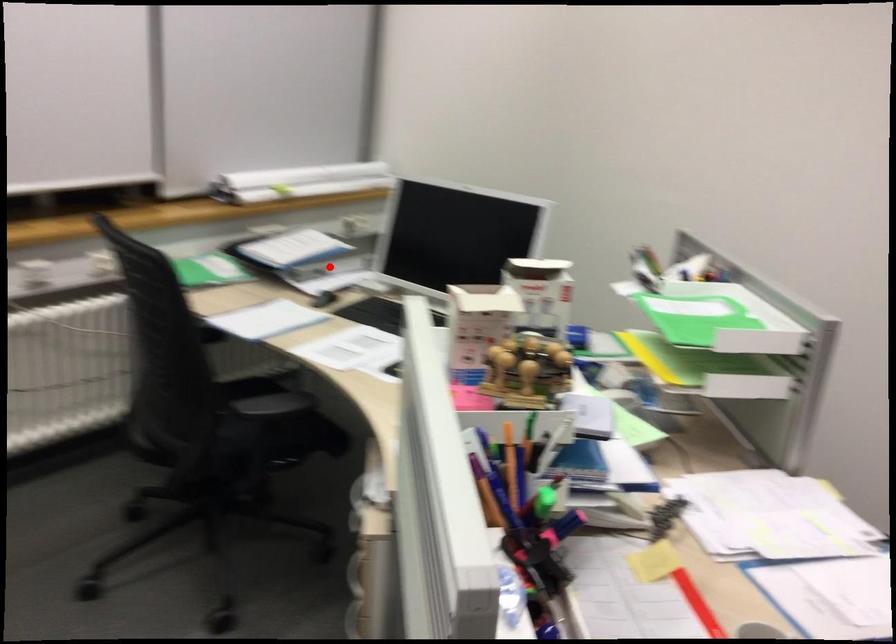
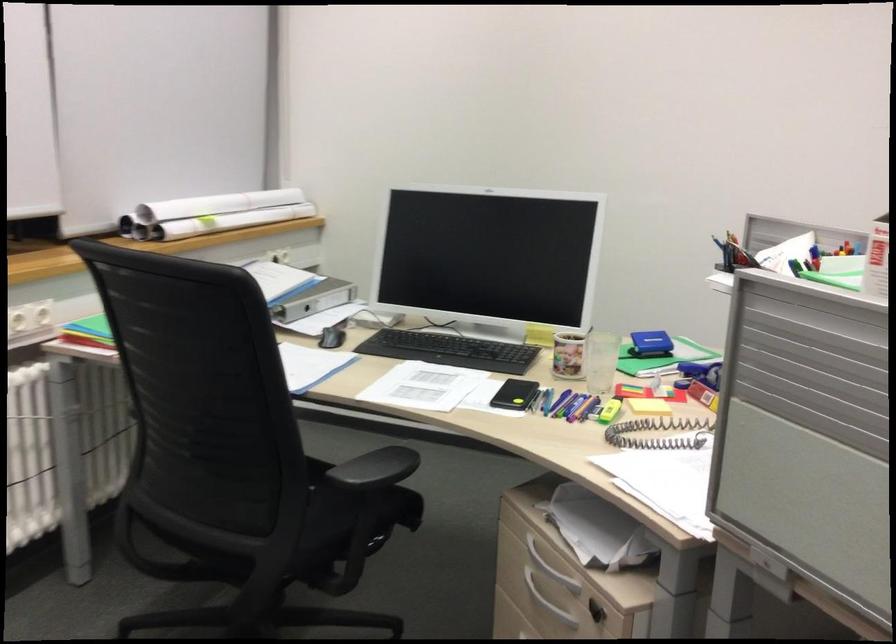
Question: A red point is marked in image1. In image2, is the corresponding 3D point closer to the camera or farther? Reply with the corresponding letter.

Choices:
 (A) The corresponding 3D point is closer.
 (B) The corresponding 3D point is farther.

Answer: (A)